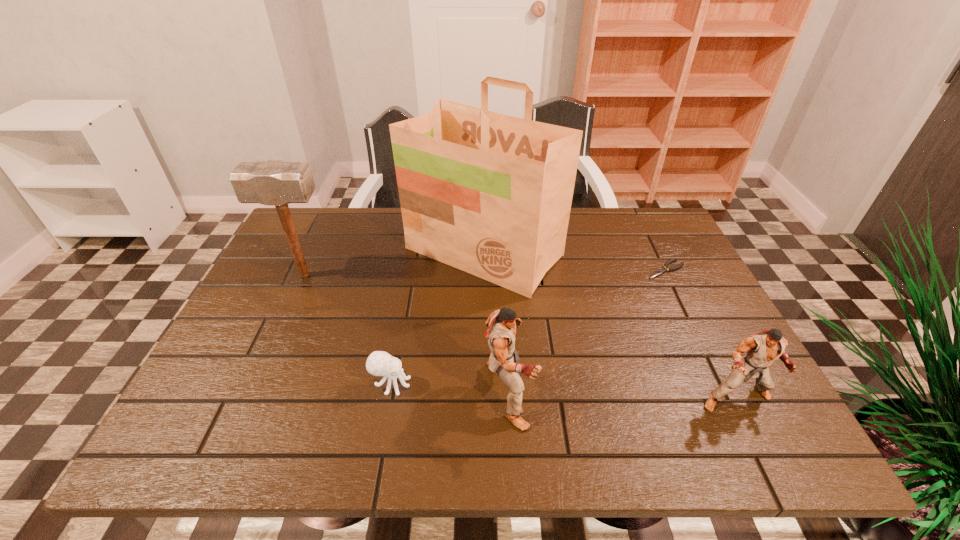
This screenshot has width=960, height=540. I want to click on free region located 0.070m on the left of the grocery bag, so click(x=381, y=252).

The height and width of the screenshot is (540, 960). What are the coordinates of `blank space located 0.140m on the front of the shortest object` in the screenshot? It's located at (688, 316).

Locate an element on the screen. This screenshot has width=960, height=540. free location located on the striking face of the fifth shortest object is located at coordinates pyautogui.click(x=451, y=275).

Where is `vacant space located 0.150m on the front-facing side of the octopus`? vacant space located 0.150m on the front-facing side of the octopus is located at coordinates (480, 383).

This screenshot has width=960, height=540. In order to click on object located at the far edge in this screenshot , I will do `click(489, 194)`.

Locate an element on the screen. octopus located in the near edge section of the desktop is located at coordinates (379, 363).

Locate an element on the screen. object at the left edge is located at coordinates (278, 183).

Identify the location of puncher positioned at the right edge. Image resolution: width=960 pixels, height=540 pixels. click(x=763, y=348).

Where is `pliers situated at the right edge`? pliers situated at the right edge is located at coordinates point(659,272).

I want to click on object present at the near right corner, so click(763, 348).